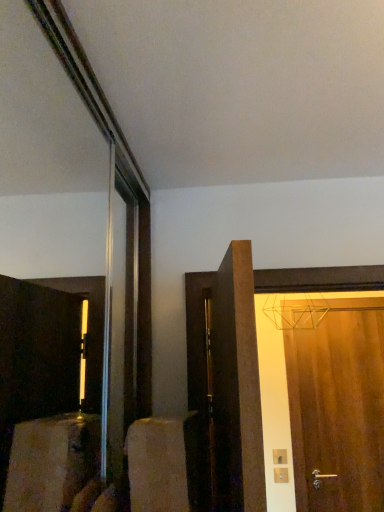
Question: Is wooden door at right, placed as the 1th door when sorted from back to front, surrounding dark wood door at center, the second door positioned from the back?

Choices:
 (A) no
 (B) yes

Answer: (A)

Question: Is wooden door at right, placed as the 1th door when sorted from back to front, oriented towards dark wood door at center, the second door in the right-to-left sequence?

Choices:
 (A) yes
 (B) no

Answer: (A)

Question: Is wooden door at right, the second door from the left, bigger than dark wood door at center, the second door in the right-to-left sequence?

Choices:
 (A) yes
 (B) no

Answer: (B)

Question: Is wooden door at right, which is the 1th door from right to left, facing away from dark wood door at center, the second door in the right-to-left sequence?

Choices:
 (A) no
 (B) yes

Answer: (A)

Question: From a real-world perspective, does wooden door at right, the second door from the left, stand above dark wood door at center, which ranks as the 1th door in left-to-right order?

Choices:
 (A) no
 (B) yes

Answer: (A)

Question: Can you see wooden door at right, placed as the 1th door when sorted from back to front, touching dark wood door at center, the second door positioned from the back?

Choices:
 (A) no
 (B) yes

Answer: (A)

Question: Is dark wood door at center, the second door positioned from the back, located outside wooden door at right, which is the 1th door from right to left?

Choices:
 (A) no
 (B) yes

Answer: (B)

Question: Can you confirm if dark wood door at center, which ranks as the 1th door in left-to-right order, is positioned to the right of wooden door at right, positioned as the 2th door in front-to-back order?

Choices:
 (A) yes
 (B) no

Answer: (B)

Question: Is dark wood door at center, the second door positioned from the back, beside wooden door at right, placed as the 1th door when sorted from back to front?

Choices:
 (A) no
 (B) yes

Answer: (A)

Question: From the image's perspective, is dark wood door at center, the second door in the right-to-left sequence, located beneath wooden door at right, which is the 1th door from right to left?

Choices:
 (A) yes
 (B) no

Answer: (B)

Question: Does dark wood door at center, the first door viewed from the front, have a lesser width compared to wooden door at right, which is the 1th door from right to left?

Choices:
 (A) no
 (B) yes

Answer: (A)

Question: Is dark wood door at center, the first door viewed from the front, shorter than wooden door at right, placed as the 1th door when sorted from back to front?

Choices:
 (A) yes
 (B) no

Answer: (A)

Question: From the image's perspective, relative to dark wood door at center, which ranks as the 1th door in left-to-right order, is wooden door at right, the second door from the left, above or below?

Choices:
 (A) above
 (B) below

Answer: (B)